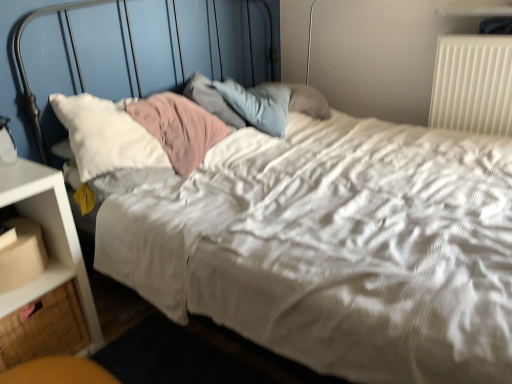
Question: In terms of size, does white plastic radiator at upper right appear bigger or smaller than beige fabric drawer at lower left?

Choices:
 (A) small
 (B) big

Answer: (B)

Question: Considering the positions of white plastic radiator at upper right and beige fabric drawer at lower left in the image, is white plastic radiator at upper right taller or shorter than beige fabric drawer at lower left?

Choices:
 (A) short
 (B) tall

Answer: (B)

Question: Estimate the real-world distances between objects in this image. Which object is farther from the white plastic radiator at upper right?

Choices:
 (A) beige fabric drawer at lower left
 (B) white plastic nightstand at lower left
 (C) matte cardboard box at lower left

Answer: (A)

Question: Which of these objects is positioned closest to the white plastic radiator at upper right?

Choices:
 (A) matte cardboard box at lower left
 (B) beige fabric drawer at lower left
 (C) white plastic nightstand at lower left

Answer: (C)